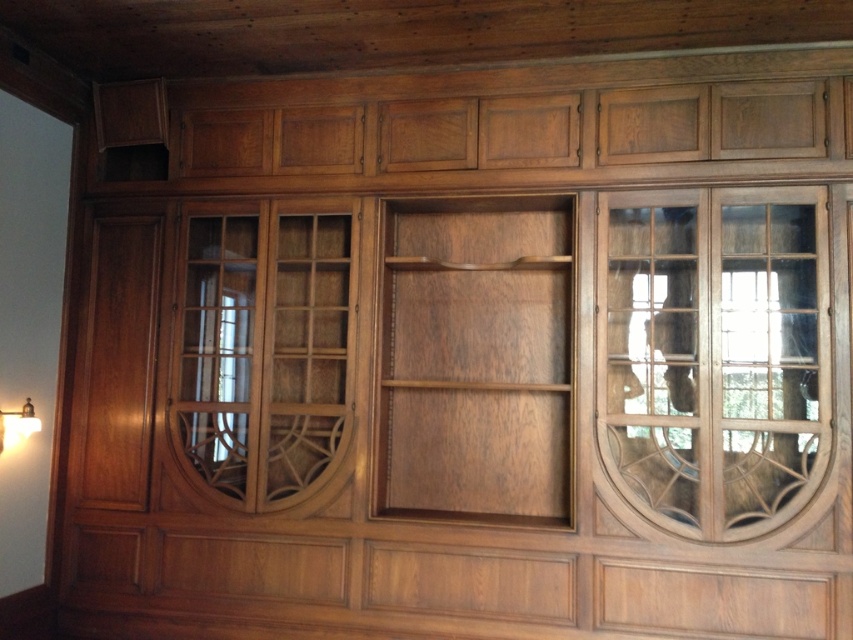
Question: Does clear glass door at center appear over matte gold lampshade at lower left?

Choices:
 (A) no
 (B) yes

Answer: (B)

Question: Which point is farther from the camera taking this photo?

Choices:
 (A) 20,417
 (B) 225,371
 (C) 631,449

Answer: (B)

Question: Which object is farther from the camera taking this photo?

Choices:
 (A) matte gold lampshade at lower left
 (B) clear glass door at center

Answer: (B)

Question: Can you confirm if transparent wood glass door at center right is positioned to the left of clear glass door at center?

Choices:
 (A) no
 (B) yes

Answer: (A)

Question: In this image, where is transparent wood glass door at center right located relative to matte gold lampshade at lower left?

Choices:
 (A) above
 (B) below

Answer: (A)

Question: Estimate the real-world distances between objects in this image. Which object is farther from the transparent wood glass door at center right?

Choices:
 (A) clear glass door at center
 (B) matte gold lampshade at lower left

Answer: (B)